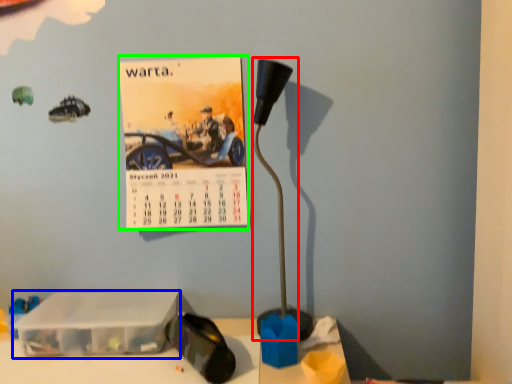
Question: Which is nearer to the lamp (highlighted by a red box)? box (highlighted by a blue box) or postcard (highlighted by a green box).

Choices:
 (A) box
 (B) postcard

Answer: (B)